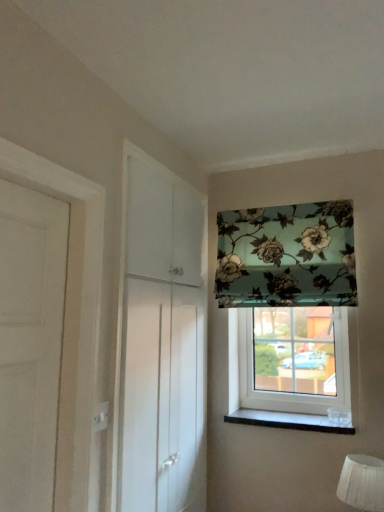
The height and width of the screenshot is (512, 384). Describe the element at coordinates (160, 339) in the screenshot. I see `white glossy cabinet at left` at that location.

Measure the distance between point (184,262) and camera.

Point (184,262) and camera are 1.97 meters apart.

This screenshot has height=512, width=384. What do you see at coordinates (277, 386) in the screenshot?
I see `transparent glass window at center, arranged as the first window when ordered from the bottom` at bounding box center [277, 386].

Where is `black marble window sill at lower right`? This screenshot has height=512, width=384. black marble window sill at lower right is located at coordinates (289, 421).

From a real-world perspective, is white glossy cabinet at left positioned over transparent glass window at center, arranged as the first window when ordered from the bottom, based on gravity?

Yes, from a real-world perspective, white glossy cabinet at left is on top of transparent glass window at center, arranged as the first window when ordered from the bottom.

Would you say transparent glass window at center, arranged as the first window when ordered from the bottom, is part of white glossy cabinet at left's contents?

No.

Is white glossy cabinet at left closer to camera compared to transparent glass window at center, arranged as the first window when ordered from the bottom?

That is True.

Is point (178, 278) closer or farther from the camera than point (276, 379)?

Point (178, 278) is positioned closer to the camera compared to point (276, 379).

Which is more to the right, white fabric lampshade at lower right or floral fabric at upper right, which appears as the 2th window when ordered from the bottom?

white fabric lampshade at lower right is more to the right.

Is white fabric lampshade at lower right next to floral fabric at upper right, which appears as the 2th window when ordered from the bottom, and touching it?

white fabric lampshade at lower right and floral fabric at upper right, which appears as the 2th window when ordered from the bottom, are clearly separated.

Can you confirm if white fabric lampshade at lower right is bigger than floral fabric at upper right, which appears as the 2th window when ordered from the bottom?

Incorrect, white fabric lampshade at lower right is not larger than floral fabric at upper right, which appears as the 2th window when ordered from the bottom.

Is white fabric lampshade at lower right inside or outside of floral fabric at upper right, which appears as the 2th window when ordered from the bottom?

white fabric lampshade at lower right lies outside floral fabric at upper right, which appears as the 2th window when ordered from the bottom.

Consider the image. Is white fabric lampshade at lower right positioned with its back to transparent glass window at center, which is counted as the second window, starting from the top?

white fabric lampshade at lower right is not turned away from transparent glass window at center, which is counted as the second window, starting from the top.

Is white fabric lampshade at lower right wider or thinner than transparent glass window at center, arranged as the first window when ordered from the bottom?

In the image, white fabric lampshade at lower right appears to be wider than transparent glass window at center, arranged as the first window when ordered from the bottom.

Which is farther from the camera, (363, 489) or (229, 322)?

Result: Point (229, 322)

Considering the sizes of objects black marble window sill at lower right and white fabric lampshade at lower right in the image provided, who is wider, black marble window sill at lower right or white fabric lampshade at lower right?

black marble window sill at lower right is wider.

From a real-world perspective, which is physically below, black marble window sill at lower right or white fabric lampshade at lower right?

white fabric lampshade at lower right is physically lower.

Which point is more distant from viewer, (232, 419) or (370, 457)?

The point (232, 419) is farther.

Is black marble window sill at lower right not close to white fabric lampshade at lower right?

No, black marble window sill at lower right is in close proximity to white fabric lampshade at lower right.

Would you say transparent glass window at center, which is counted as the second window, starting from the top, is inside or outside black marble window sill at lower right?

transparent glass window at center, which is counted as the second window, starting from the top, is spatially situated outside black marble window sill at lower right.

Is transparent glass window at center, arranged as the first window when ordered from the bottom, turned away from black marble window sill at lower right?

No, transparent glass window at center, arranged as the first window when ordered from the bottom,'s orientation is not away from black marble window sill at lower right.

Which is more to the right, transparent glass window at center, which is counted as the second window, starting from the top, or black marble window sill at lower right?

Positioned to the right is transparent glass window at center, which is counted as the second window, starting from the top.

Find the location of a particular element. window sill on the left of transparent glass window at center, which is counted as the second window, starting from the top is located at coordinates (289, 421).

Relative to white glossy cabinet at left, is black marble window sill at lower right in front or behind?

In the image, black marble window sill at lower right appears behind white glossy cabinet at left.

From a real-world perspective, is black marble window sill at lower right on white glossy cabinet at left?

Incorrect, from a real-world perspective, black marble window sill at lower right is lower than white glossy cabinet at left.

Is point (224, 419) positioned after point (194, 389)?

Yes, it is.

Looking at this image, does black marble window sill at lower right have a larger size compared to white glossy cabinet at left?

No.

Is transparent glass window at center, arranged as the first window when ordered from the bottom, oriented towards white glossy cabinet at left?

Yes, transparent glass window at center, arranged as the first window when ordered from the bottom, is facing white glossy cabinet at left.

From the image's perspective, is transparent glass window at center, arranged as the first window when ordered from the bottom, on top of white glossy cabinet at left?

Incorrect, from the image's perspective, transparent glass window at center, arranged as the first window when ordered from the bottom, is lower than white glossy cabinet at left.

Is point (340, 369) farther from viewer compared to point (128, 163)?

Yes, it is behind point (128, 163).

Is transparent glass window at center, which is counted as the second window, starting from the top, outside of white glossy cabinet at left?

Yes, transparent glass window at center, which is counted as the second window, starting from the top, is outside of white glossy cabinet at left.

Identify the location of window below the white glossy cabinet at left (from a real-world perspective). This screenshot has height=512, width=384. (277, 386).

Locate an element on the screen. This screenshot has width=384, height=512. the 2nd window above the white fabric lampshade at lower right (from a real-world perspective) is located at coordinates (287, 256).

From the image, which object appears to be farther from transparent glass window at center, which is counted as the second window, starting from the top, black marble window sill at lower right or floral fabric at upper right, which appears as the 2th window when ordered from the bottom?

floral fabric at upper right, which appears as the 2th window when ordered from the bottom.

Which object lies further to the anchor point white fabric lampshade at lower right, white glossy cabinet at left or floral fabric at upper right, which appears as the 2th window when ordered from the bottom?

Among the two, white glossy cabinet at left is located further to white fabric lampshade at lower right.

From the image, which object appears to be nearer to white glossy cabinet at left, white fabric lampshade at lower right or transparent glass window at center, which is counted as the second window, starting from the top?

transparent glass window at center, which is counted as the second window, starting from the top, is positioned closer to the anchor white glossy cabinet at left.

Considering their positions, is black marble window sill at lower right positioned further to floral fabric at upper right, which ranks as the 1th window in top-to-bottom order, than white fabric lampshade at lower right?

white fabric lampshade at lower right.

Looking at the image, which one is located closer to black marble window sill at lower right, white fabric lampshade at lower right or floral fabric at upper right, which appears as the 2th window when ordered from the bottom?

The object closer to black marble window sill at lower right is white fabric lampshade at lower right.

When comparing their distances from white glossy cabinet at left, does transparent glass window at center, arranged as the first window when ordered from the bottom, or floral fabric at upper right, which appears as the 2th window when ordered from the bottom, seem closer?

floral fabric at upper right, which appears as the 2th window when ordered from the bottom, is closer to white glossy cabinet at left.

From the image, which object appears to be nearer to white glossy cabinet at left, floral fabric at upper right, which ranks as the 1th window in top-to-bottom order, or white fabric lampshade at lower right?

floral fabric at upper right, which ranks as the 1th window in top-to-bottom order, lies closer to white glossy cabinet at left than the other object.

From the picture: From the image, which object appears to be farther from white fabric lampshade at lower right, transparent glass window at center, which is counted as the second window, starting from the top, or floral fabric at upper right, which ranks as the 1th window in top-to-bottom order?

Among the two, floral fabric at upper right, which ranks as the 1th window in top-to-bottom order, is located further to white fabric lampshade at lower right.

The image size is (384, 512). I want to click on window between floral fabric at upper right, which appears as the 2th window when ordered from the bottom, and white fabric lampshade at lower right, in the vertical direction, so click(277, 386).

At what (x,y) coordinates should I click in order to perform the action: click on screen door between floral fabric at upper right, which ranks as the 1th window in top-to-bottom order, and white fabric lampshade at lower right in the up-down direction. Please return your answer as a coordinate pair (x, y). The height and width of the screenshot is (512, 384). Looking at the image, I should click on click(x=160, y=339).

At what (x,y) coordinates should I click in order to perform the action: click on window sill located between white glossy cabinet at left and white fabric lampshade at lower right in the left-right direction. Please return your answer as a coordinate pair (x, y). This screenshot has width=384, height=512. Looking at the image, I should click on (289, 421).

Identify the location of window sill between white fabric lampshade at lower right and transparent glass window at center, which is counted as the second window, starting from the top, in the front-back direction. This screenshot has width=384, height=512. (289, 421).